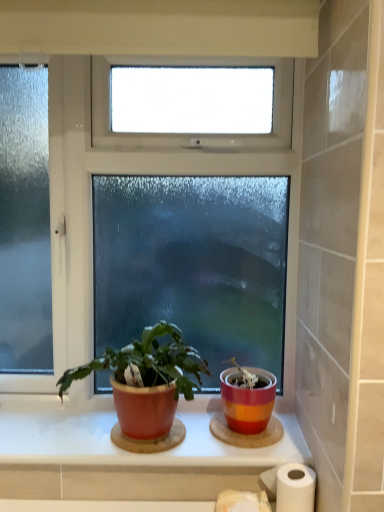
What is the approximate height of clear glass window at center?

clear glass window at center is 95.45 centimeters in height.

What do you see at coordinates (129, 458) in the screenshot? The width and height of the screenshot is (384, 512). I see `matte ceramic window sill at center` at bounding box center [129, 458].

The width and height of the screenshot is (384, 512). What do you see at coordinates (247, 401) in the screenshot?
I see `striped ceramic pot at center` at bounding box center [247, 401].

The height and width of the screenshot is (512, 384). I want to click on white matte toilet paper at lower center, so click(x=242, y=502).

Does matte red pot at center have a greater width compared to clear glass window at center?

Indeed, matte red pot at center has a greater width compared to clear glass window at center.

Find the location of `window above the matte red pot at center (from a real-world perspective)`. window above the matte red pot at center (from a real-world perspective) is located at coordinates (138, 173).

Are matte red pot at center and clear glass window at center making contact?

No, matte red pot at center is not making contact with clear glass window at center.

From the picture: Can you confirm if matte red pot at center is taller than white paper at lower right?

Yes.

From the image's perspective, is matte red pot at center positioned above or below white paper at lower right?

From the image's perspective, matte red pot at center appears above white paper at lower right.

Which of these two, matte red pot at center or white paper at lower right, is thinner?

With smaller width is white paper at lower right.

Does matte red pot at center have a smaller size compared to white paper at lower right?

No.

Is clear glass window at center touching matte red pot at center?

No, clear glass window at center is not making contact with matte red pot at center.

Which object is positioned more to the right, clear glass window at center or matte red pot at center?

Positioned to the right is matte red pot at center.

In terms of width, does clear glass window at center look wider or thinner when compared to matte red pot at center?

clear glass window at center is thinner than matte red pot at center.

Which is farther, (60, 147) or (99, 358)?

The point (60, 147) is behind.

Measure the distance from clear glass window at center to white paper at lower right.

clear glass window at center is 25.74 inches from white paper at lower right.

Does clear glass window at center lie behind white paper at lower right?

Yes, clear glass window at center is behind white paper at lower right.

Between point (291, 285) and point (282, 472), which one is positioned in front?

Positioned in front is point (282, 472).

Can you confirm if clear glass window at center is bigger than white paper at lower right?

Yes, clear glass window at center is bigger than white paper at lower right.

Can you tell me how much striped ceramic pot at center and white matte toilet paper at lower center differ in facing direction?

They differ by 0.0816 degrees in their facing directions.

Is striped ceramic pot at center further to the viewer compared to white matte toilet paper at lower center?

Yes, striped ceramic pot at center is behind white matte toilet paper at lower center.

Is striped ceramic pot at center placed right next to white matte toilet paper at lower center?

No, striped ceramic pot at center is not next to white matte toilet paper at lower center.

Looking at this image, which is closer to the camera, (258,400) or (247,502)?

The point (247,502) is in front.

Between point (244, 507) and point (181, 154), which one is positioned behind?

The point (181, 154) is farther from the camera.

From the image's perspective, is white matte toilet paper at lower center positioned above or below clear glass window at center?

white matte toilet paper at lower center is situated lower than clear glass window at center in the image.

Is white matte toilet paper at lower center taller or shorter than clear glass window at center?

Considering their sizes, white matte toilet paper at lower center has less height than clear glass window at center.

Does white matte toilet paper at lower center have a lesser width compared to clear glass window at center?

Incorrect, the width of white matte toilet paper at lower center is not less than that of clear glass window at center.

Is matte ceramic window sill at center positioned far away from white paper at lower right?

That's not correct — matte ceramic window sill at center is a little close to white paper at lower right.

There is a white paper at lower right. Identify the location of window sill above it (from a real-world perspective). (129, 458).

Considering the relative sizes of matte ceramic window sill at center and white paper at lower right in the image provided, is matte ceramic window sill at center thinner than white paper at lower right?

Incorrect, the width of matte ceramic window sill at center is not less than that of white paper at lower right.

From a real-world perspective, is matte ceramic window sill at center beneath white paper at lower right?

No, from a real-world perspective, matte ceramic window sill at center is not under white paper at lower right.

I want to click on window above the matte red pot at center (from the image's perspective), so click(x=138, y=173).

Locate an element on the screen. houseplant on the left of white paper at lower right is located at coordinates (147, 381).

Estimate the real-world distances between objects in this image. Which object is further from matte red pot at center, clear glass window at center or white paper at lower right?

white paper at lower right is further to matte red pot at center.

From the image, which object appears to be farther from matte red pot at center, white paper at lower right or striped ceramic pot at center?

white paper at lower right.

Looking at the image, which one is located closer to white paper at lower right, matte ceramic window sill at center or white matte toilet paper at lower center?

white matte toilet paper at lower center is positioned closer to the anchor white paper at lower right.

When comparing their distances from matte ceramic window sill at center, does striped ceramic pot at center or matte red pot at center seem closer?

matte red pot at center is positioned closer to the anchor matte ceramic window sill at center.

Estimate the real-world distances between objects in this image. Which object is closer to matte ceramic window sill at center, matte red pot at center or clear glass window at center?

matte red pot at center is positioned closer to the anchor matte ceramic window sill at center.

Estimate the real-world distances between objects in this image. Which object is further from clear glass window at center, matte red pot at center or matte ceramic window sill at center?

matte ceramic window sill at center is positioned further to the anchor clear glass window at center.

Looking at this image, estimate the real-world distances between objects in this image. Which object is closer to white matte toilet paper at lower center, matte ceramic window sill at center or matte red pot at center?

matte ceramic window sill at center lies closer to white matte toilet paper at lower center than the other object.

Estimate the real-world distances between objects in this image. Which object is further from white matte toilet paper at lower center, matte red pot at center or white paper at lower right?

matte red pot at center is further to white matte toilet paper at lower center.

You are a GUI agent. You are given a task and a screenshot of the screen. Output one action in this format:
    pyautogui.click(x=<x>, y=<y>)
    Task: Click on the houseplant between clear glass window at center and white paper at lower right in the vertical direction
    
    Given the screenshot: What is the action you would take?
    pyautogui.click(x=147, y=381)

Where is `window sill between clear glass window at center and white paper at lower right vertically`? The image size is (384, 512). window sill between clear glass window at center and white paper at lower right vertically is located at coordinates (129, 458).

You are a GUI agent. You are given a task and a screenshot of the screen. Output one action in this format:
    pyautogui.click(x=<x>, y=<y>)
    Task: Click on the flowerpot between clear glass window at center and white paper at lower right vertically
    The image size is (384, 512).
    Given the screenshot: What is the action you would take?
    pyautogui.click(x=247, y=401)

Locate an element on the screen. flowerpot located between matte ceramic window sill at center and white paper at lower right in the left-right direction is located at coordinates (247, 401).